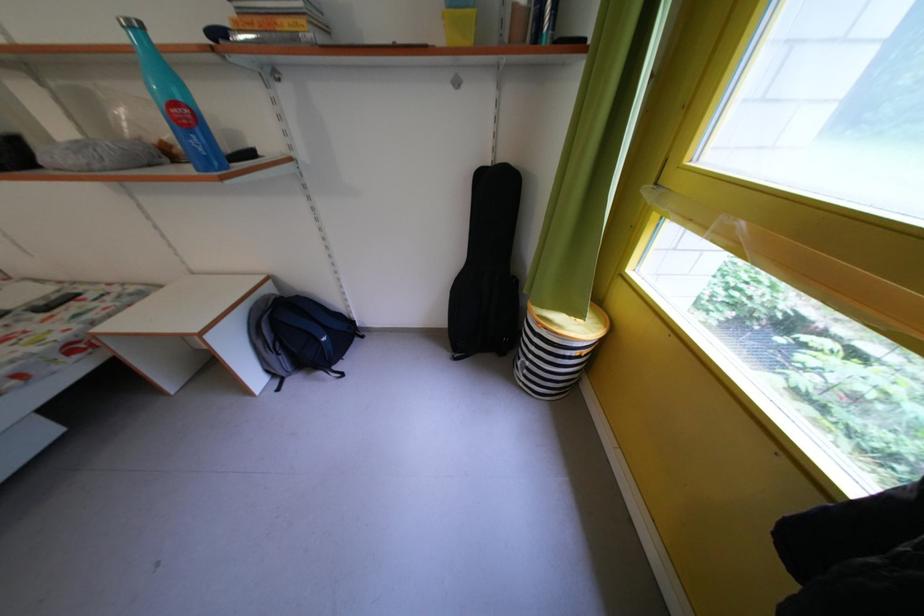
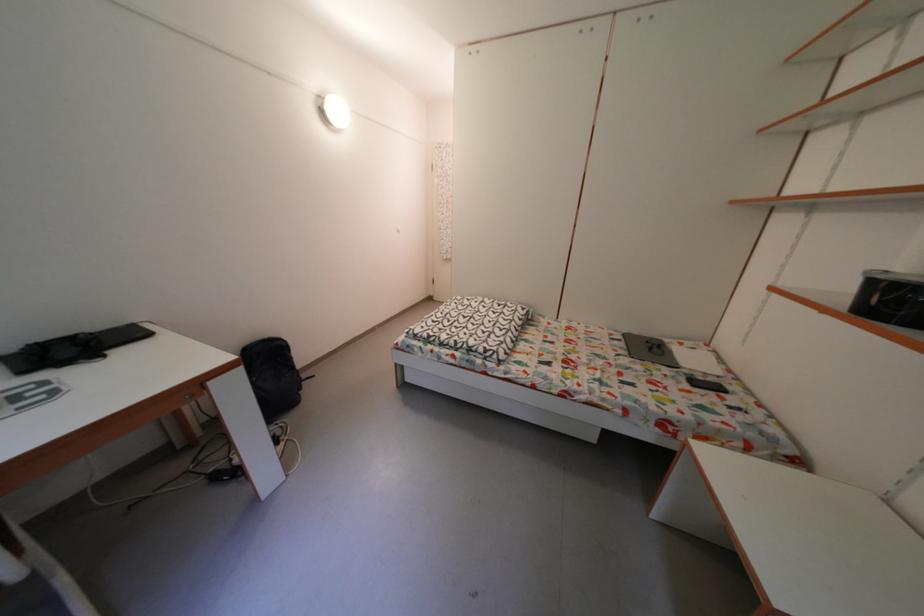
In the scene shown: The images are taken continuously from a first-person perspective. In which direction is your viewpoint rotating?

The camera's rotation is toward left-down.